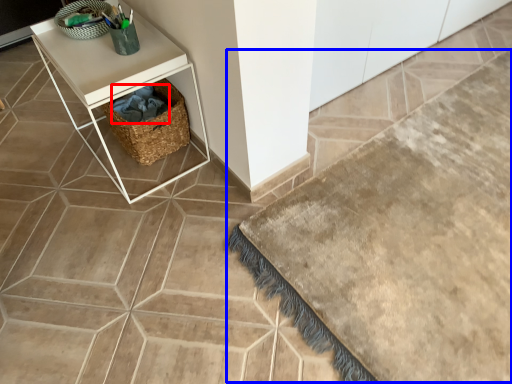
Question: Among these objects, which one is nearest to the camera, material (highlighted by a red box) or bath mat (highlighted by a blue box)?

Choices:
 (A) material
 (B) bath mat

Answer: (B)